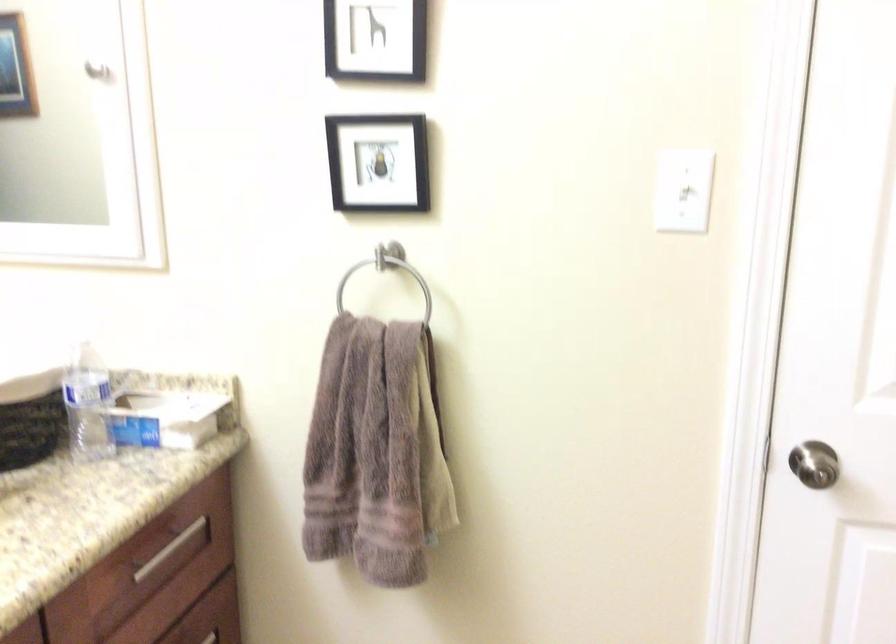
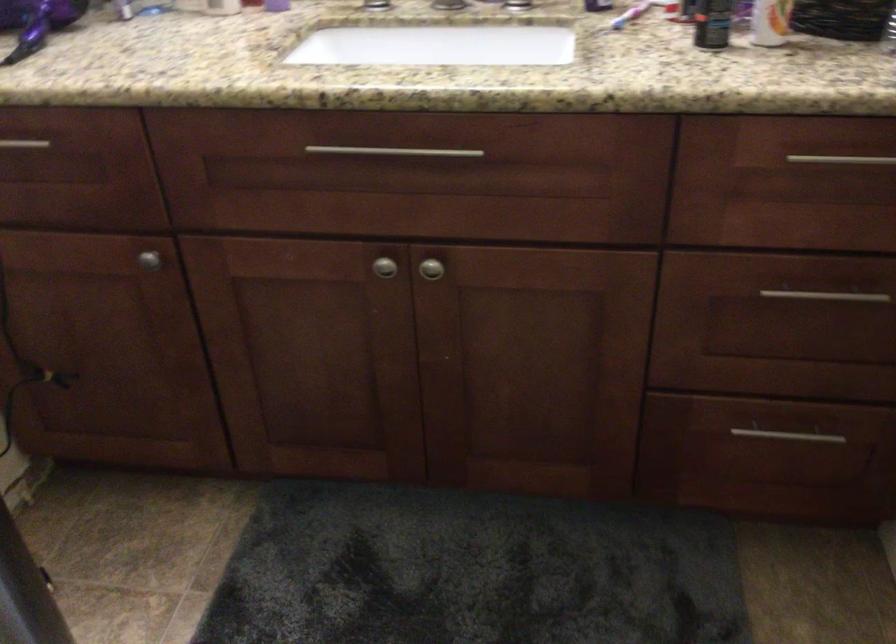
The point at (161, 550) is marked in the first image. Where is the corresponding point in the second image?

(841, 158)